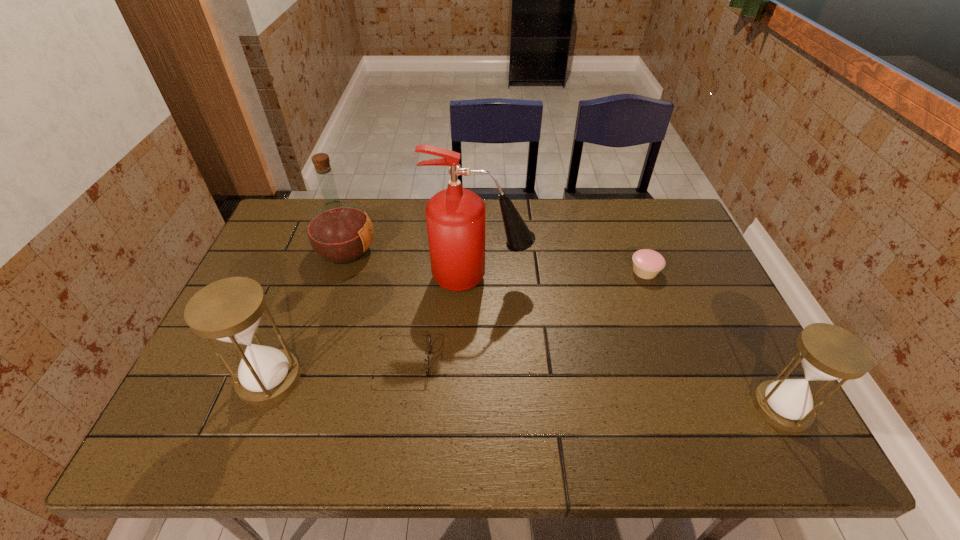
This screenshot has height=540, width=960. I want to click on free region located on the left of the fourth tallest object, so click(x=732, y=407).

Image resolution: width=960 pixels, height=540 pixels. What are the coordinates of `free space located on the back of the fifth tallest object` in the screenshot? It's located at (628, 226).

Where is `free space located 0.170m on the front label of the liquor`? free space located 0.170m on the front label of the liquor is located at coordinates (432, 251).

Identify the location of vacant space situated on the front-facing side of the sunglasses. (562, 361).

The width and height of the screenshot is (960, 540). In order to click on free space located 0.110m with the nozzle aimed from the fire extinguisher in this screenshot , I will do `click(568, 278)`.

The height and width of the screenshot is (540, 960). What are the coordinates of `object at the far edge` in the screenshot? It's located at click(x=339, y=232).

Locate an element on the screen. sunglasses that is positioned at the near edge is located at coordinates (429, 349).

Where is `hourglass at the left edge`? The width and height of the screenshot is (960, 540). hourglass at the left edge is located at coordinates (229, 310).

Locate an element on the screen. Image resolution: width=960 pixels, height=540 pixels. liquor located in the left edge section of the desktop is located at coordinates coord(339,232).

You are a GUI agent. You are given a task and a screenshot of the screen. Output one action in this format:
    pyautogui.click(x=<x>, y=<y>)
    Task: Click on the hourglass that is at the right edge
    This screenshot has height=540, width=960.
    Given the screenshot: What is the action you would take?
    pyautogui.click(x=828, y=352)